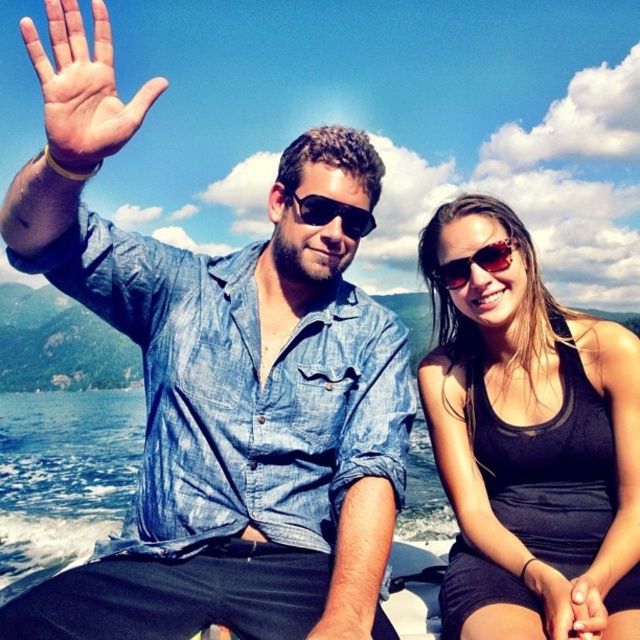
How much distance is there between matte skin palm at upper left and sunglasses at center?

matte skin palm at upper left and sunglasses at center are 8.89 meters apart.

Which is behind, point (157, 93) or point (499, 250)?

Point (499, 250)

This screenshot has height=640, width=640. I want to click on matte skin palm at upper left, so pos(83,88).

What do you see at coordinates (570, 602) in the screenshot?
I see `matte skin hand at lower right` at bounding box center [570, 602].

Is matte skin hand at lower right positioned in front of black plastic sunglasses at center?

Yes.

Is point (566, 589) farther from camera compared to point (342, 211)?

No, (566, 589) is in front of (342, 211).

The width and height of the screenshot is (640, 640). I want to click on matte skin hand at lower right, so click(x=570, y=602).

Can you confirm if denim shirt at left is thinner than sunglasses at center?

In fact, denim shirt at left might be wider than sunglasses at center.

Does denim shirt at left come in front of sunglasses at center?

Yes, denim shirt at left is in front of sunglasses at center.

Image resolution: width=640 pixels, height=640 pixels. Describe the element at coordinates (221, 380) in the screenshot. I see `denim shirt at left` at that location.

Find the location of a particular element. The image size is (640, 640). denim shirt at left is located at coordinates (221, 380).